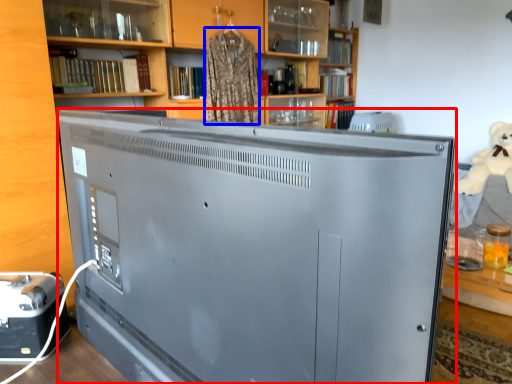
Question: Which object appears farthest to the camera in this image, television (highlighted by a red box) or clothing (highlighted by a blue box)?

Choices:
 (A) television
 (B) clothing

Answer: (B)